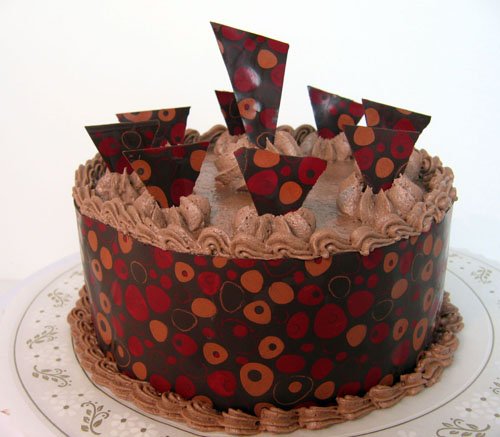
You are a GUI agent. You are given a task and a screenshot of the screen. Output one action in this format:
    pyautogui.click(x=<x>, y=<y>)
    Task: Click on the decorative patter
    The width and height of the screenshot is (500, 437).
    Given the screenshot: What is the action you would take?
    pyautogui.click(x=41, y=370), pyautogui.click(x=90, y=413)